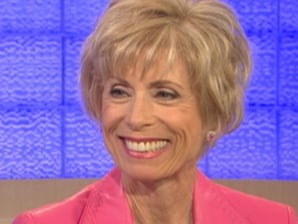
What are the coordinates of `beige couch` in the screenshot? It's located at (36, 196).